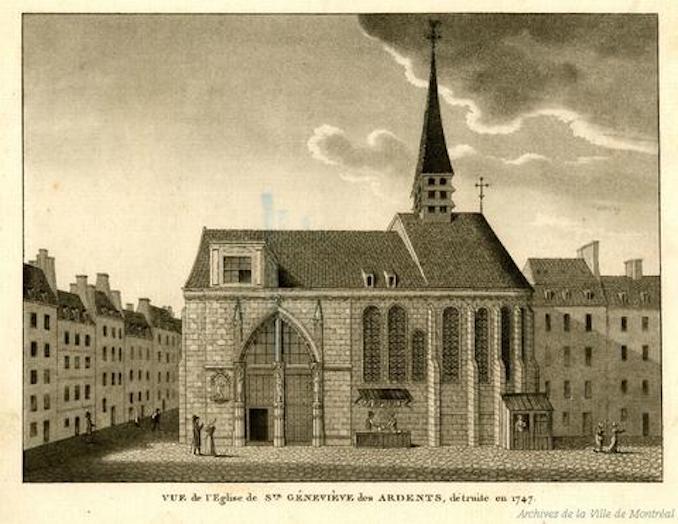
The height and width of the screenshot is (524, 678). Find the location of `door`. door is located at coordinates (268, 427).